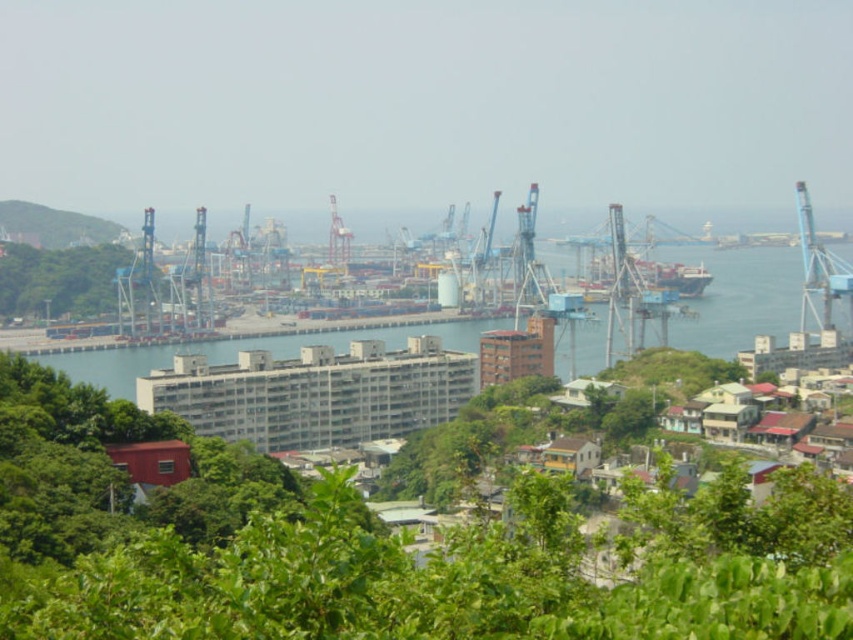
Does green leafy tree at left come in front of metallic gray crane at center?

No, green leafy tree at left is behind metallic gray crane at center.

The width and height of the screenshot is (853, 640). What are the coordinates of `green leafy tree at left` in the screenshot? It's located at (61, 280).

Can you confirm if blue water at center is positioned to the right of green grassy hillside at upper left?

Correct, you'll find blue water at center to the right of green grassy hillside at upper left.

Is point (590, 344) in front of point (57, 230)?

Yes, it is.

Is point (758, 275) positioned before point (88, 244)?

That is True.

You are a GUI agent. You are given a task and a screenshot of the screen. Output one action in this format:
    pyautogui.click(x=<x>, y=<y>)
    Task: Click on the blue water at center
    This screenshot has width=853, height=640.
    Given the screenshot: What is the action you would take?
    pyautogui.click(x=740, y=298)

Does point (112, 362) lie in front of point (329, 228)?

No.

Can you confirm if blue water at center is taller than metallic gray crane at center?

Correct, blue water at center is much taller as metallic gray crane at center.

Describe the element at coordinates (740, 298) in the screenshot. I see `blue water at center` at that location.

The width and height of the screenshot is (853, 640). In order to click on blue water at center in this screenshot , I will do `click(740, 298)`.